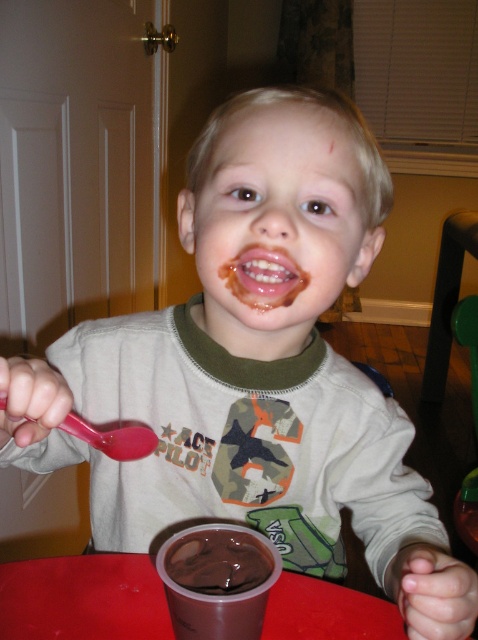
Is point (217, 241) positioned before point (187, 561)?

No, (217, 241) is behind (187, 561).

Between point (293, 157) and point (195, 532), which one is positioned behind?

Positioned behind is point (293, 157).

I want to click on smooth chocolate face at center, so click(279, 221).

Image resolution: width=478 pixels, height=640 pixels. I want to click on smooth chocolate face at center, so click(279, 221).

Between point (14, 572) and point (159, 564), which one is positioned in front?

Positioned in front is point (159, 564).

Does point (152, 596) come in front of point (220, 548)?

No, (152, 596) is further to viewer.

You are a GUI agent. You are given a task and a screenshot of the screen. Output one action in this format:
    pyautogui.click(x=<x>, y=<y>)
    Task: Click on the smooth plastic table at center
    
    Given the screenshot: What is the action you would take?
    pyautogui.click(x=84, y=598)

Identify the location of smooth plastic table at center. The image size is (478, 640). (84, 598).

Is smooth plastic table at center shorter than chocolate smoothie at lower center?

Correct, smooth plastic table at center is not as tall as chocolate smoothie at lower center.

Locate an element on the screen. This screenshot has width=478, height=640. smooth plastic table at center is located at coordinates (84, 598).

This screenshot has height=640, width=478. In order to click on smooth plastic table at center in this screenshot , I will do `click(84, 598)`.